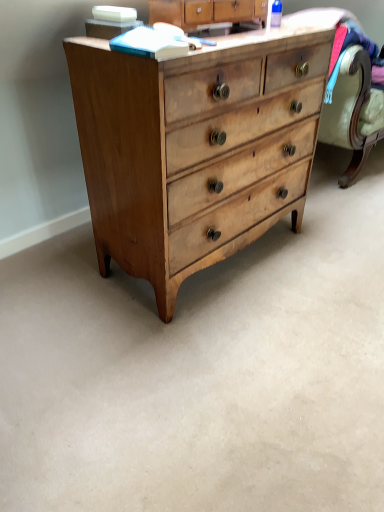
You are a GUI agent. You are given a task and a screenshot of the screen. Output one action in this format:
    pyautogui.click(x=<x>, y=<y>)
    Task: Click on the vacant area that is situated to the right of light brown wood chest of drawers at center
    The image size is (384, 512).
    Given the screenshot: What is the action you would take?
    pyautogui.click(x=323, y=260)